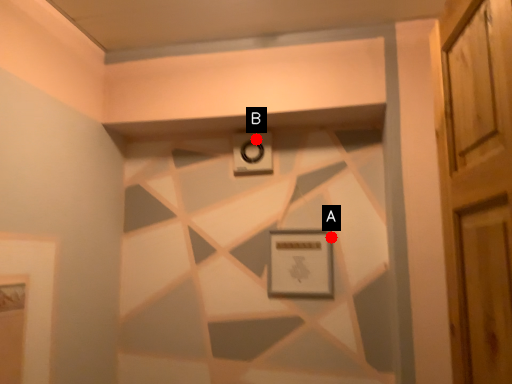
Question: Two points are circled on the image, labeled by A and B beside each circle. Which point is farther to the camera?

Choices:
 (A) A is further
 (B) B is further

Answer: (B)